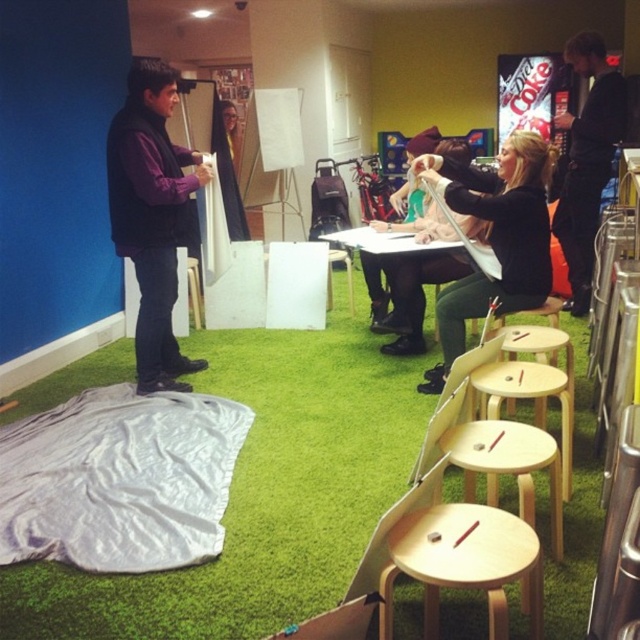
You are a photographer setting up for a group photo in the room. You need to ensure that the black matte shirt at center and the black fabric at upper right are both visible in the frame. Which object should you position closer to the camera to avoid it being cropped out?

The black matte shirt at center is not as tall as black fabric at upper right, so you should position the black matte shirt at center closer to the camera to ensure it is fully visible in the frame.

You are standing in the room and want to place a 5 feet long ladder against the wall. The light wood stool at lower center is in your way. Can you move the stool to make space for the ladder?

The light wood stool at lower center is 4.95 feet away from the viewer. Since the ladder is 5 feet long, moving the stool would allow enough space for the ladder to be placed against the wall.